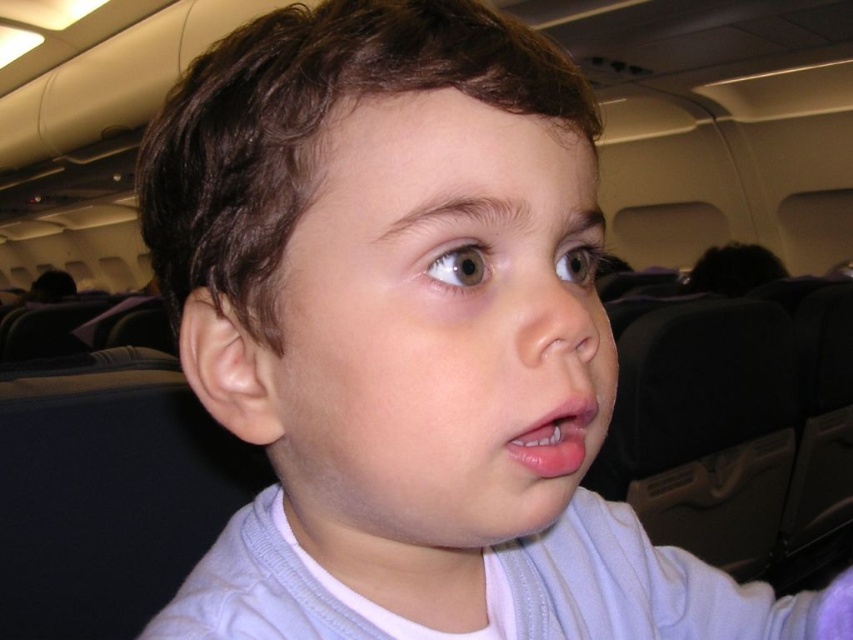
You are a photographer adjusting your camera settings to capture the child in the airplane cabin. The camera has a focus point at coordinates point (563, 312). Based on the scene, what part of the child is the focus point likely targeting?

The focus point at coordinates point (563, 312) corresponds to the smooth skin nose at center, so the camera is focusing on the child nose.

You are a photographer adjusting your camera settings to focus on the child in the airplane cabin. Since the smooth skin nose at center and pink glossy lips at center are both in the frame, which one should you focus on first to ensure proper depth of field?

The smooth skin nose at center is closer to the viewer than the pink glossy lips at center, so focusing on the nose first will ensure proper depth of field for both objects.